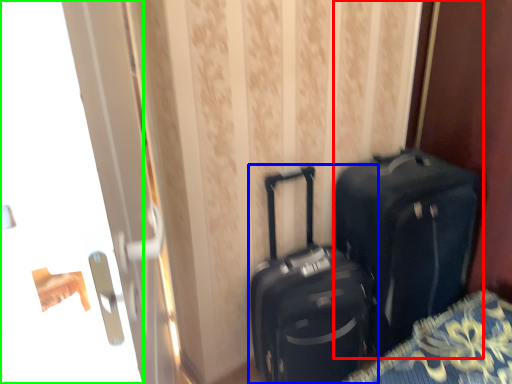
Question: Estimate the real-world distances between objects in this image. Which object is farther from luggage and bags (highlighted by a red box), suitcase (highlighted by a blue box) or screen door (highlighted by a green box)?

Choices:
 (A) suitcase
 (B) screen door

Answer: (B)